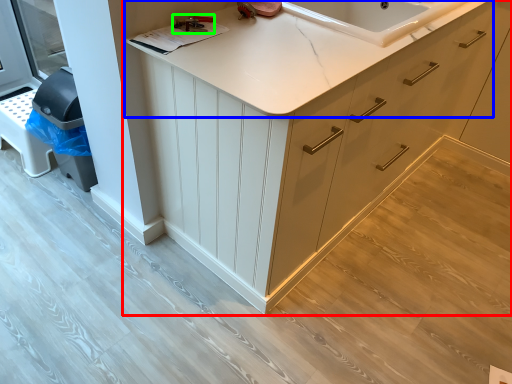
Question: Which is nearer to the cabinetry (highlighted by a red box)? countertop (highlighted by a blue box) or tool (highlighted by a green box).

Choices:
 (A) countertop
 (B) tool

Answer: (A)